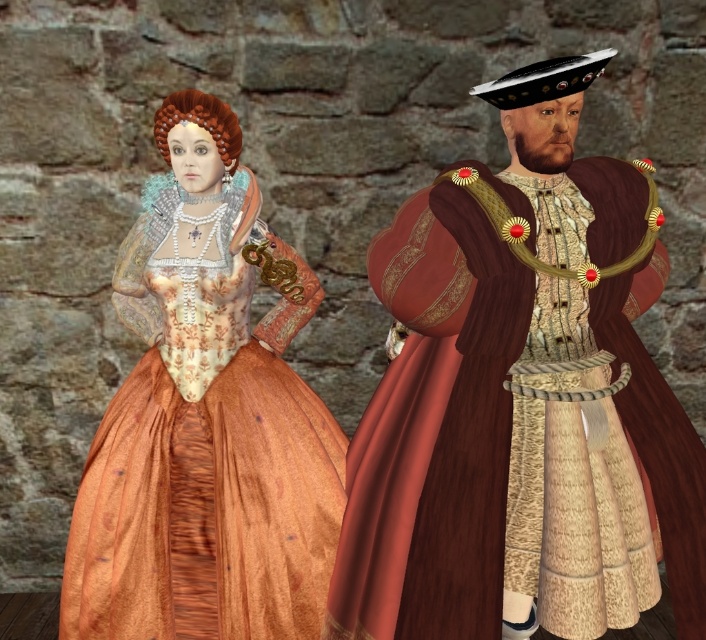
You are an art conservator examining the Renaissance painting. You have a small brush that can reach up to 1.8 meters. Can you clean the velvet gold brocade robe at right without moving the painting?

The velvet gold brocade robe at right is 2.06 meters away from viewer, which is beyond the reach of the brush that can only reach up to 1.8 meters. Therefore, you cannot clean it without moving the painting.

You are a costume designer preparing for a historical play. You need to ensure that the velvet gold brocade robe at right and the matte gold dress at center are arranged properly in the scene. According to the image, which item is covering part of the other?

The velvet gold brocade robe at right is positioned over the matte gold dress at center, meaning it is covering part of the dress.